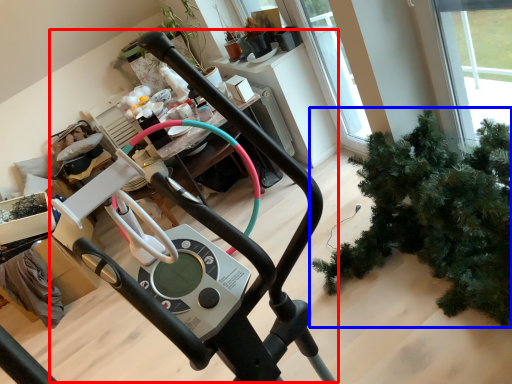
Question: Which object is further to the camera taking this photo, sport equipment (highlighted by a red box) or houseplant (highlighted by a blue box)?

Choices:
 (A) sport equipment
 (B) houseplant

Answer: (B)